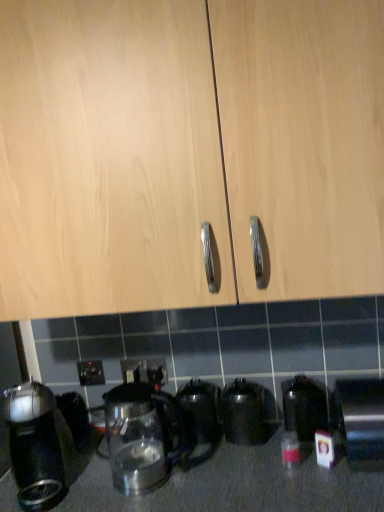
In order to click on satin silver toaster at lower right, which ranks as the 1th kitchen appliance in right-to-left order in this screenshot , I will do `click(361, 420)`.

In the scene shown: How much space does satin silver toaster at lower right, which is the 6th kitchen appliance from left to right, occupy vertically?

satin silver toaster at lower right, which is the 6th kitchen appliance from left to right, is 7.32 inches tall.

The height and width of the screenshot is (512, 384). What do you see at coordinates (155, 371) in the screenshot?
I see `black plastic electric outlet at lower center, arranged as the 3th electric outlet when viewed from the left` at bounding box center [155, 371].

This screenshot has height=512, width=384. Identify the location of translucent glass bottle at lower right. (290, 448).

What do you see at coordinates (37, 445) in the screenshot? I see `black plastic coffee maker at left, acting as the 6th kitchen appliance starting from the right` at bounding box center [37, 445].

In order to click on transparent glass kettle at lower center, the second kitchen appliance when ordered from right to left in this screenshot , I will do (x=304, y=407).

Is black plastic electric outlet at lower center, the 2th electric outlet viewed from the left, bigger or smaller than light wood cabinet at center?

black plastic electric outlet at lower center, the 2th electric outlet viewed from the left, is smaller than light wood cabinet at center.

Can you confirm if black plastic electric outlet at lower center, the 2th electric outlet viewed from the left, is positioned to the right of light wood cabinet at center?

In fact, black plastic electric outlet at lower center, the 2th electric outlet viewed from the left, is to the left of light wood cabinet at center.

Is black plastic electric outlet at lower center, the 2th electric outlet viewed from the left, looking in the opposite direction of light wood cabinet at center?

No, black plastic electric outlet at lower center, the 2th electric outlet viewed from the left, is not facing away from light wood cabinet at center.

Is translucent glass bottle at lower right positioned far away from transparent glass kettle at lower center, which is the 5th kitchen appliance from left to right?

Actually, translucent glass bottle at lower right and transparent glass kettle at lower center, which is the 5th kitchen appliance from left to right, are a little close together.

Does translucent glass bottle at lower right turn towards transparent glass kettle at lower center, the second kitchen appliance when ordered from right to left?

No, translucent glass bottle at lower right does not turn towards transparent glass kettle at lower center, the second kitchen appliance when ordered from right to left.

Between translucent glass bottle at lower right and transparent glass kettle at lower center, the second kitchen appliance when ordered from right to left, which one appears on the left side from the viewer's perspective?

From the viewer's perspective, translucent glass bottle at lower right appears more on the left side.

In the scene shown: Does black plastic electric outlet at lower center, the 2th electric outlet viewed from the left, have a smaller size compared to transparent glass kettle at lower center, the second kitchen appliance when ordered from right to left?

Indeed, black plastic electric outlet at lower center, the 2th electric outlet viewed from the left, has a smaller size compared to transparent glass kettle at lower center, the second kitchen appliance when ordered from right to left.

From a real-world perspective, is black plastic electric outlet at lower center, the 2th electric outlet viewed from the left, positioned above or below transparent glass kettle at lower center, the second kitchen appliance when ordered from right to left?

Clearly, from a real-world perspective, black plastic electric outlet at lower center, the 2th electric outlet viewed from the left, is above transparent glass kettle at lower center, the second kitchen appliance when ordered from right to left.

Is point (148, 366) positioned after point (300, 376)?

That is True.

Would you consider black plastic electric outlet at lower center, the 2th electric outlet viewed from the left, to be distant from transparent glass kettle at lower center, the second kitchen appliance when ordered from right to left?

No, black plastic electric outlet at lower center, the 2th electric outlet viewed from the left, is in close proximity to transparent glass kettle at lower center, the second kitchen appliance when ordered from right to left.

From a real-world perspective, between transparent glass kettle at center, marked as the 3th kitchen appliance in a left-to-right arrangement, and black plastic electric outlet at lower center, arranged as the 3th electric outlet when viewed from the left, who is vertically higher?

In real-world perspective, black plastic electric outlet at lower center, arranged as the 3th electric outlet when viewed from the left, is above.

Which is behind, transparent glass kettle at center, marked as the 3th kitchen appliance in a left-to-right arrangement, or black plastic electric outlet at lower center, the first electric outlet in the right-to-left sequence?

Positioned behind is black plastic electric outlet at lower center, the first electric outlet in the right-to-left sequence.

Is black plastic electric outlet at lower center, the first electric outlet in the right-to-left sequence, at the back of transparent glass kettle at center, which appears as the 4th kitchen appliance when viewed from the right?

That's not correct — transparent glass kettle at center, which appears as the 4th kitchen appliance when viewed from the right, is not looking away from black plastic electric outlet at lower center, the first electric outlet in the right-to-left sequence.

Considering the sizes of transparent glass kettle at center, which appears as the 4th kitchen appliance when viewed from the right, and black plastic electric outlet at lower center, arranged as the 3th electric outlet when viewed from the left, in the image, is transparent glass kettle at center, which appears as the 4th kitchen appliance when viewed from the right, taller or shorter than black plastic electric outlet at lower center, arranged as the 3th electric outlet when viewed from the left,?

transparent glass kettle at center, which appears as the 4th kitchen appliance when viewed from the right, is taller than black plastic electric outlet at lower center, arranged as the 3th electric outlet when viewed from the left.

Can you confirm if black plastic electric outlet at lower center, the 2th electric outlet viewed from the left, is thinner than translucent glass bottle at lower right?

Indeed, black plastic electric outlet at lower center, the 2th electric outlet viewed from the left, has a lesser width compared to translucent glass bottle at lower right.

Is black plastic electric outlet at lower center, the 2th electric outlet viewed from the left, far away from translucent glass bottle at lower right?

They are positioned close to each other.

Does black plastic electric outlet at lower center, the 2th electric outlet positioned from the right, have a larger size compared to translucent glass bottle at lower right?

Yes, black plastic electric outlet at lower center, the 2th electric outlet positioned from the right, is bigger than translucent glass bottle at lower right.

Between black plastic electric outlet at lower center, the first electric outlet in the right-to-left sequence, and light wood cabinet at center, which one has smaller width?

black plastic electric outlet at lower center, the first electric outlet in the right-to-left sequence.

Is black plastic electric outlet at lower center, the first electric outlet in the right-to-left sequence, positioned far away from light wood cabinet at center?

No, black plastic electric outlet at lower center, the first electric outlet in the right-to-left sequence, is in close proximity to light wood cabinet at center.

Is black plastic electric outlet at lower center, the first electric outlet in the right-to-left sequence, aimed at light wood cabinet at center?

No, black plastic electric outlet at lower center, the first electric outlet in the right-to-left sequence, does not turn towards light wood cabinet at center.

Consider the image. Based on their positions, is black plastic electric outlet at lower center, the 2th electric outlet positioned from the right, located to the left or right of black plastic electric outlet at lower center, the first electric outlet in the right-to-left sequence?

black plastic electric outlet at lower center, the 2th electric outlet positioned from the right, is positioned on black plastic electric outlet at lower center, the first electric outlet in the right-to-left sequence,'s left side.

Can you confirm if black plastic electric outlet at lower center, the 2th electric outlet positioned from the right, is smaller than black plastic electric outlet at lower center, arranged as the 3th electric outlet when viewed from the left?

No, black plastic electric outlet at lower center, the 2th electric outlet positioned from the right, is not smaller than black plastic electric outlet at lower center, arranged as the 3th electric outlet when viewed from the left.

What's the angular difference between black plastic electric outlet at lower center, the 2th electric outlet viewed from the left, and black plastic electric outlet at lower center, arranged as the 3th electric outlet when viewed from the left,'s facing directions?

There is a 0.00426-degree angle between the facing directions of black plastic electric outlet at lower center, the 2th electric outlet viewed from the left, and black plastic electric outlet at lower center, arranged as the 3th electric outlet when viewed from the left.

Is black plastic electric outlet at lower center, the 2th electric outlet positioned from the right, with black plastic electric outlet at lower center, the first electric outlet in the right-to-left sequence?

Yes, the surface of black plastic electric outlet at lower center, the 2th electric outlet positioned from the right, is in contact with black plastic electric outlet at lower center, the first electric outlet in the right-to-left sequence.

Locate an element on the screen. This screenshot has height=512, width=384. cabinetry in front of the black plastic electric outlet at lower center, the 2th electric outlet positioned from the right is located at coordinates (188, 152).

Locate an element on the screen. bottle below the transparent glass kettle at lower center, which is the 5th kitchen appliance from left to right (from a real-world perspective) is located at coordinates (290, 448).

Based on the photo, from the image, which object appears to be nearer to translucent glass bottle at lower right, transparent glass kettle at lower center, which is the 5th kitchen appliance from left to right, or transparent glass kettle at lower center, the second kitchen appliance when ordered from left to right?

The object closer to translucent glass bottle at lower right is transparent glass kettle at lower center, which is the 5th kitchen appliance from left to right.

Which object lies nearer to the anchor point satin silver toaster at lower right, which is the 6th kitchen appliance from left to right, black plastic electric outlet at lower center, the third electric outlet viewed from the right, or transparent glass kettle at lower center, marked as the 5th kitchen appliance in a right-to-left arrangement?

Among the two, transparent glass kettle at lower center, marked as the 5th kitchen appliance in a right-to-left arrangement, is located nearer to satin silver toaster at lower right, which is the 6th kitchen appliance from left to right.

Based on their spatial positions, is black plastic electric outlet at lower center, the third electric outlet viewed from the right, or transparent glass kettle at center, marked as the 3th kitchen appliance in a left-to-right arrangement, closer to black plastic electric outlet at lower center, arranged as the 3th electric outlet when viewed from the left?

transparent glass kettle at center, marked as the 3th kitchen appliance in a left-to-right arrangement.

When comparing their distances from transparent glass kettle at lower center, the second kitchen appliance when ordered from left to right, does black plastic coffee maker at left, acting as the 6th kitchen appliance starting from the right, or black plastic electric outlet at lower center, the first electric outlet in the right-to-left sequence, seem closer?

black plastic electric outlet at lower center, the first electric outlet in the right-to-left sequence.

Based on their spatial positions, is black metallic kettle at center, placed as the fourth kitchen appliance when sorted from left to right, or satin silver toaster at lower right, which ranks as the 1th kitchen appliance in right-to-left order, further from black plastic electric outlet at lower center, which ranks as the first electric outlet in left-to-right order?

The object further to black plastic electric outlet at lower center, which ranks as the first electric outlet in left-to-right order, is satin silver toaster at lower right, which ranks as the 1th kitchen appliance in right-to-left order.

Which object lies further to the anchor point black metallic kettle at center, arranged as the 3th kitchen appliance when viewed from the right, satin silver toaster at lower right, which is the 6th kitchen appliance from left to right, or black plastic electric outlet at lower center, arranged as the 3th electric outlet when viewed from the left?

Based on the image, satin silver toaster at lower right, which is the 6th kitchen appliance from left to right, appears to be further to black metallic kettle at center, arranged as the 3th kitchen appliance when viewed from the right.

When comparing their distances from transparent glass kettle at center, marked as the 3th kitchen appliance in a left-to-right arrangement, does black plastic electric outlet at lower center, arranged as the 3th electric outlet when viewed from the left, or translucent glass bottle at lower right seem further?

translucent glass bottle at lower right.

Estimate the real-world distances between objects in this image. Which object is further from black plastic electric outlet at lower center, the third electric outlet viewed from the right, transparent glass kettle at center, which appears as the 4th kitchen appliance when viewed from the right, or satin silver toaster at lower right, which ranks as the 1th kitchen appliance in right-to-left order?

Among the two, satin silver toaster at lower right, which ranks as the 1th kitchen appliance in right-to-left order, is located further to black plastic electric outlet at lower center, the third electric outlet viewed from the right.

The width and height of the screenshot is (384, 512). I want to click on kitchen appliance situated between transparent glass kettle at lower center, the second kitchen appliance when ordered from left to right, and black metallic kettle at center, arranged as the 3th kitchen appliance when viewed from the right, from left to right, so click(200, 417).

The height and width of the screenshot is (512, 384). I want to click on bottle between black plastic coffee maker at left, acting as the 6th kitchen appliance starting from the right, and transparent glass kettle at lower center, the second kitchen appliance when ordered from right to left, in the horizontal direction, so click(x=290, y=448).

Where is `electric outlet situated between black plastic electric outlet at lower center, which ranks as the first electric outlet in left-to-right order, and black plastic electric outlet at lower center, the first electric outlet in the right-to-left sequence, from left to right`? The width and height of the screenshot is (384, 512). electric outlet situated between black plastic electric outlet at lower center, which ranks as the first electric outlet in left-to-right order, and black plastic electric outlet at lower center, the first electric outlet in the right-to-left sequence, from left to right is located at coordinates (144, 370).

Identify the location of electric outlet that lies between light wood cabinet at center and black plastic electric outlet at lower center, the 2th electric outlet positioned from the right, from top to bottom. (155, 371).